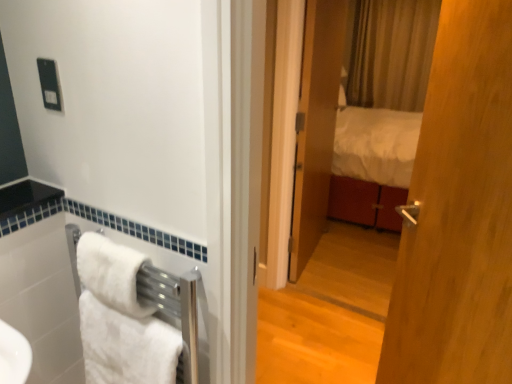
In order to face matte wooden mirror at center, should I rotate leftwards or rightwards?

Turn right approximately 12.935 degrees to face it.

Identify the location of black plastic outlet at upper left. (49, 84).

The width and height of the screenshot is (512, 384). I want to click on matte wooden mirror at center, so click(x=362, y=153).

Between wooden door at center and matte wooden mirror at center, which one appears on the left side from the viewer's perspective?

Positioned to the left is wooden door at center.

Can you tell me how much wooden door at center and matte wooden mirror at center differ in facing direction?

98.7 degrees.

Is wooden door at center not close to matte wooden mirror at center?

wooden door at center is near matte wooden mirror at center, not far away.

The width and height of the screenshot is (512, 384). I want to click on mirror lying on the right of wooden door at center, so click(362, 153).

From the image's perspective, which one is positioned lower, black plastic outlet at upper left or white soft towel at lower left, which is the 1th towel/napkin in top-to-bottom order?

From the image's view, white soft towel at lower left, which is the 1th towel/napkin in top-to-bottom order, is below.

Is black plastic outlet at upper left with white soft towel at lower left, which is the 1th towel/napkin in top-to-bottom order?

There is a gap between black plastic outlet at upper left and white soft towel at lower left, which is the 1th towel/napkin in top-to-bottom order.

Considering the positions of points (54, 71) and (91, 249), is point (54, 71) closer to camera compared to point (91, 249)?

Yes, it is in front of point (91, 249).

Between black plastic outlet at upper left and white soft towel at lower left, which is the 1th towel/napkin in top-to-bottom order, which one has less height?

Standing shorter between the two is black plastic outlet at upper left.

Between white soft towel at lower left, which is the 2th towel/napkin in bottom-to-top order, and wooden door at center, which one has smaller width?

wooden door at center is thinner.

Does white soft towel at lower left, which is the 2th towel/napkin in bottom-to-top order, have a lesser height compared to wooden door at center?

Correct, white soft towel at lower left, which is the 2th towel/napkin in bottom-to-top order, is not as tall as wooden door at center.

Is white soft towel at lower left, which is the 2th towel/napkin in bottom-to-top order, in contact with wooden door at center?

white soft towel at lower left, which is the 2th towel/napkin in bottom-to-top order, and wooden door at center are not in contact.

From a real-world perspective, between white soft towel at lower left, which is the 1th towel/napkin in top-to-bottom order, and wooden door at center, who is vertically higher?

→ From a 3D spatial view, white soft towel at lower left, which is the 1th towel/napkin in top-to-bottom order, is above.

Is white fluffy towel at lower left, which is counted as the 1th towel/napkin, starting from the bottom, at the back of white soft towel at lower left, which is the 1th towel/napkin in top-to-bottom order?

No, white soft towel at lower left, which is the 1th towel/napkin in top-to-bottom order, is not facing away from white fluffy towel at lower left, which is counted as the 1th towel/napkin, starting from the bottom.

Considering the points (95, 246) and (167, 381), which point is behind, point (95, 246) or point (167, 381)?

The point (95, 246) is behind.

Are white soft towel at lower left, which is the 1th towel/napkin in top-to-bottom order, and white fluffy towel at lower left, which is counted as the 1th towel/napkin, starting from the bottom, beside each other?

white soft towel at lower left, which is the 1th towel/napkin in top-to-bottom order, and white fluffy towel at lower left, which is counted as the 1th towel/napkin, starting from the bottom, are clearly separated.

Which of these two, white soft towel at lower left, which is the 2th towel/napkin in bottom-to-top order, or white fluffy towel at lower left, which is counted as the 1th towel/napkin, starting from the bottom, stands taller?

white fluffy towel at lower left, which is counted as the 1th towel/napkin, starting from the bottom.

Between matte wooden mirror at center and white fluffy towel at lower left, which is counted as the 1th towel/napkin, starting from the bottom, which one has larger width?

With larger width is white fluffy towel at lower left, which is counted as the 1th towel/napkin, starting from the bottom.

From a real-world perspective, is matte wooden mirror at center on white fluffy towel at lower left, the 2th towel/napkin viewed from the top?

Correct, in the physical world, matte wooden mirror at center is higher than white fluffy towel at lower left, the 2th towel/napkin viewed from the top.

Considering the relative sizes of matte wooden mirror at center and white fluffy towel at lower left, the 2th towel/napkin viewed from the top, in the image provided, is matte wooden mirror at center shorter than white fluffy towel at lower left, the 2th towel/napkin viewed from the top,?

In fact, matte wooden mirror at center may be taller than white fluffy towel at lower left, the 2th towel/napkin viewed from the top.

Is matte wooden mirror at center positioned with its back to white fluffy towel at lower left, the 2th towel/napkin viewed from the top?

That's not correct — matte wooden mirror at center is not looking away from white fluffy towel at lower left, the 2th towel/napkin viewed from the top.

Consider the image. In the image, is white soft towel at lower left, which is the 2th towel/napkin in bottom-to-top order, positioned in front of or behind matte wooden mirror at center?

Visually, white soft towel at lower left, which is the 2th towel/napkin in bottom-to-top order, is located in front of matte wooden mirror at center.

Is matte wooden mirror at center a part of white soft towel at lower left, which is the 2th towel/napkin in bottom-to-top order?

No, matte wooden mirror at center is not a part of white soft towel at lower left, which is the 2th towel/napkin in bottom-to-top order.

Looking at the image, does white soft towel at lower left, which is the 1th towel/napkin in top-to-bottom order, seem bigger or smaller compared to matte wooden mirror at center?

In the image, white soft towel at lower left, which is the 1th towel/napkin in top-to-bottom order, appears to be smaller than matte wooden mirror at center.

Considering the relative positions of white soft towel at lower left, which is the 1th towel/napkin in top-to-bottom order, and matte wooden mirror at center in the image provided, is white soft towel at lower left, which is the 1th towel/napkin in top-to-bottom order, to the left of matte wooden mirror at center from the viewer's perspective?

Correct, you'll find white soft towel at lower left, which is the 1th towel/napkin in top-to-bottom order, to the left of matte wooden mirror at center.

Can you tell me how much matte wooden mirror at center and wooden door at center differ in facing direction?

The facing directions of matte wooden mirror at center and wooden door at center are 98.7 degrees apart.

From the image's perspective, is matte wooden mirror at center on wooden door at center?

No, from the image's perspective, matte wooden mirror at center is not on top of wooden door at center.

Is matte wooden mirror at center at the left side of wooden door at center?

In fact, matte wooden mirror at center is to the right of wooden door at center.

Considering the sizes of objects matte wooden mirror at center and wooden door at center in the image provided, who is thinner, matte wooden mirror at center or wooden door at center?

wooden door at center is thinner.

Locate an element on the screen. mirror below the wooden door at center (from the image's perspective) is located at coordinates (362, 153).

This screenshot has width=512, height=384. In order to click on electric outlet lying above the white soft towel at lower left, which is the 2th towel/napkin in bottom-to-top order (from the image's perspective) in this screenshot , I will do `click(49, 84)`.

Considering their positions, is white soft towel at lower left, which is the 2th towel/napkin in bottom-to-top order, positioned further to matte wooden mirror at center than white fluffy towel at lower left, which is counted as the 1th towel/napkin, starting from the bottom?

The object further to matte wooden mirror at center is white soft towel at lower left, which is the 2th towel/napkin in bottom-to-top order.

Looking at the image, which one is located closer to white soft towel at lower left, which is the 1th towel/napkin in top-to-bottom order, matte wooden mirror at center or white fluffy towel at lower left, which is counted as the 1th towel/napkin, starting from the bottom?

The object closer to white soft towel at lower left, which is the 1th towel/napkin in top-to-bottom order, is white fluffy towel at lower left, which is counted as the 1th towel/napkin, starting from the bottom.

Considering their positions, is white fluffy towel at lower left, the 2th towel/napkin viewed from the top, positioned closer to matte wooden mirror at center than black plastic outlet at upper left?

white fluffy towel at lower left, the 2th towel/napkin viewed from the top, is positioned closer to the anchor matte wooden mirror at center.

Based on their spatial positions, is white fluffy towel at lower left, which is counted as the 1th towel/napkin, starting from the bottom, or white soft towel at lower left, which is the 2th towel/napkin in bottom-to-top order, further from black plastic outlet at upper left?

white fluffy towel at lower left, which is counted as the 1th towel/napkin, starting from the bottom, lies further to black plastic outlet at upper left than the other object.

Considering their positions, is black plastic outlet at upper left positioned closer to matte wooden mirror at center than white fluffy towel at lower left, the 2th towel/napkin viewed from the top?

white fluffy towel at lower left, the 2th towel/napkin viewed from the top, is closer to matte wooden mirror at center.

In the scene shown: Estimate the real-world distances between objects in this image. Which object is closer to white soft towel at lower left, which is the 2th towel/napkin in bottom-to-top order, white fluffy towel at lower left, the 2th towel/napkin viewed from the top, or matte wooden mirror at center?

Based on the image, white fluffy towel at lower left, the 2th towel/napkin viewed from the top, appears to be nearer to white soft towel at lower left, which is the 2th towel/napkin in bottom-to-top order.

Estimate the real-world distances between objects in this image. Which object is further from wooden door at center, white fluffy towel at lower left, the 2th towel/napkin viewed from the top, or black plastic outlet at upper left?

black plastic outlet at upper left lies further to wooden door at center than the other object.

Looking at the image, which one is located further to black plastic outlet at upper left, white soft towel at lower left, which is the 1th towel/napkin in top-to-bottom order, or wooden door at center?

Based on the image, wooden door at center appears to be further to black plastic outlet at upper left.

Where is `electric outlet between white fluffy towel at lower left, the 2th towel/napkin viewed from the top, and wooden door at center, along the z-axis`? Image resolution: width=512 pixels, height=384 pixels. electric outlet between white fluffy towel at lower left, the 2th towel/napkin viewed from the top, and wooden door at center, along the z-axis is located at coordinates (49, 84).

Find the location of a particular element. The image size is (512, 384). towel/napkin between white soft towel at lower left, which is the 1th towel/napkin in top-to-bottom order, and matte wooden mirror at center, in the horizontal direction is located at coordinates (126, 346).

Identify the location of towel/napkin positioned between white fluffy towel at lower left, the 2th towel/napkin viewed from the top, and wooden door at center from near to far. This screenshot has height=384, width=512. (111, 273).

In order to click on door located between black plastic outlet at upper left and matte wooden mirror at center in the left-right direction in this screenshot , I will do `click(315, 126)`.